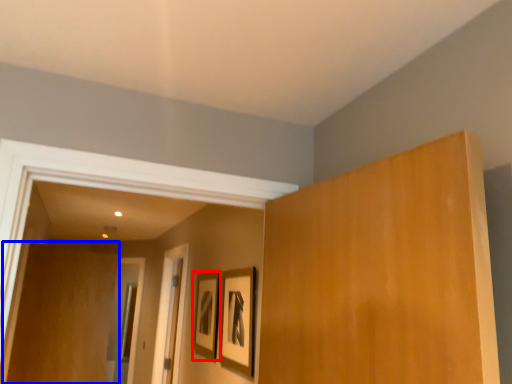
Question: Which object is further to the camera taking this photo, picture frame (highlighted by a red box) or plywood (highlighted by a blue box)?

Choices:
 (A) picture frame
 (B) plywood

Answer: (B)